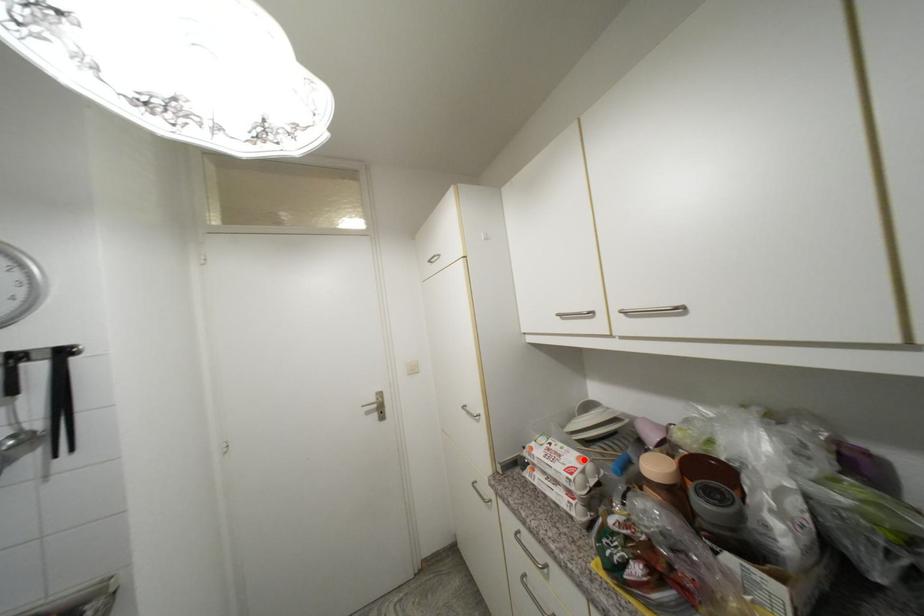
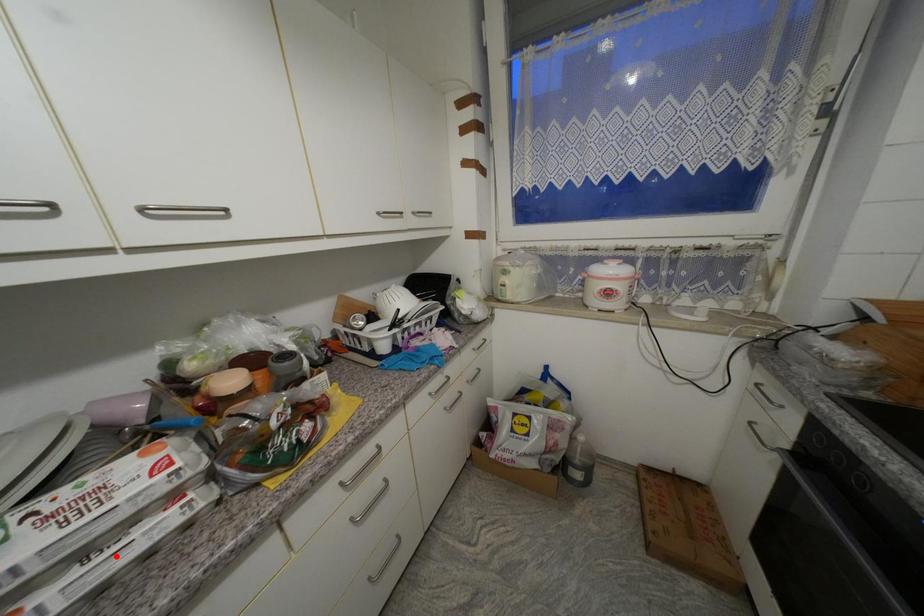
I am providing you with two images of the same scene from different viewpoints. A red point is marked on the first image and another point is marked on the second image. Do the highlighted points in image1 and image2 indicate the same real-world spot?

No